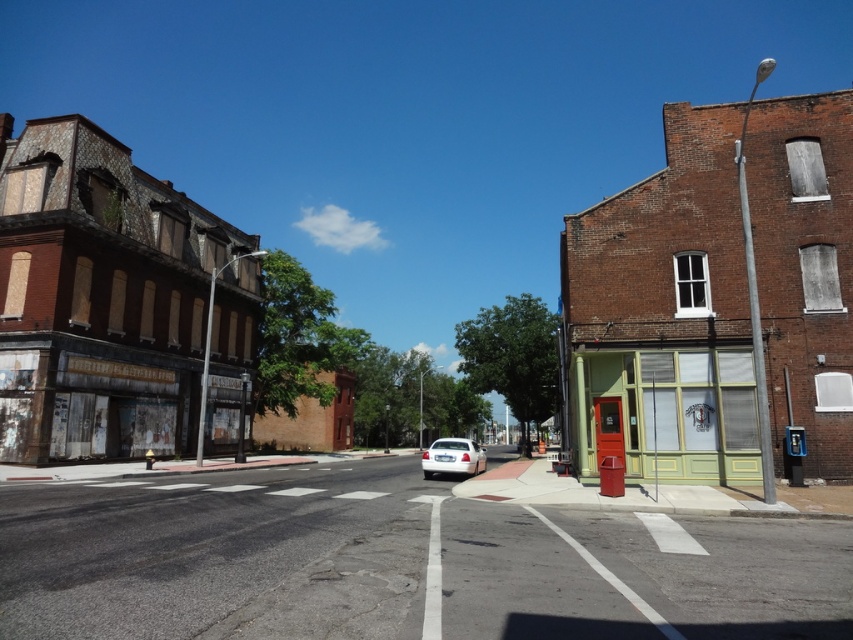
Question: Is the position of smooth asphalt road at center less distant than that of white glossy sedan at center?

Choices:
 (A) no
 (B) yes

Answer: (B)

Question: Observing the image, what is the correct spatial positioning of smooth asphalt road at center in reference to white glossy sedan at center?

Choices:
 (A) above
 (B) below

Answer: (A)

Question: Can you confirm if smooth asphalt road at center is smaller than white glossy sedan at center?

Choices:
 (A) yes
 (B) no

Answer: (A)

Question: Which of the following is the farthest from the observer?

Choices:
 (A) white glossy sedan at center
 (B) smooth asphalt road at center

Answer: (A)